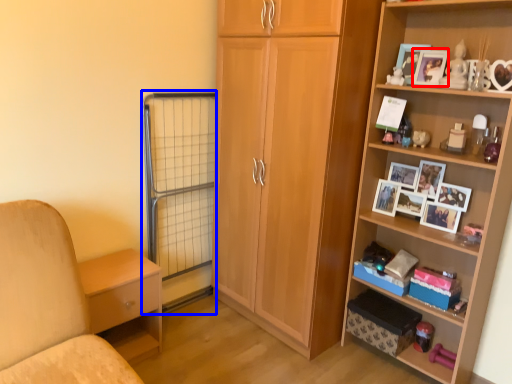
Question: Which object is closer to the camera taking this photo, picture frame (highlighted by a red box) or screen door (highlighted by a blue box)?

Choices:
 (A) picture frame
 (B) screen door

Answer: (A)